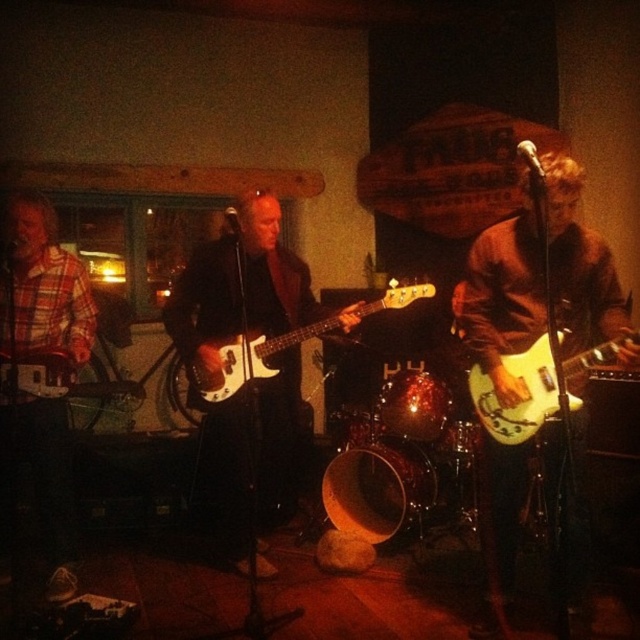
Question: Does matte white guitar at center lie in front of white glossy electric guitar at center?

Choices:
 (A) no
 (B) yes

Answer: (B)

Question: Which point appears farthest from the camera in this image?

Choices:
 (A) (513, 419)
 (B) (378, 301)
 (C) (189, 321)

Answer: (C)

Question: Among these objects, which one is farthest from the camera?

Choices:
 (A) matte black guitar at center
 (B) white glossy electric guitar at center

Answer: (B)

Question: Considering the real-world distances, which object is farthest from the matte white guitar at center?

Choices:
 (A) white glossy electric guitar at right
 (B) matte black guitar at center
 (C) white glossy electric guitar at center

Answer: (B)

Question: Is matte black guitar at center positioned in front of white glossy electric guitar at center?

Choices:
 (A) no
 (B) yes

Answer: (B)

Question: Is matte black guitar at center bigger than white glossy electric guitar at center?

Choices:
 (A) no
 (B) yes

Answer: (B)